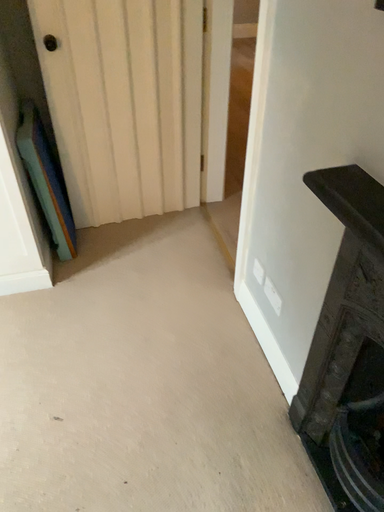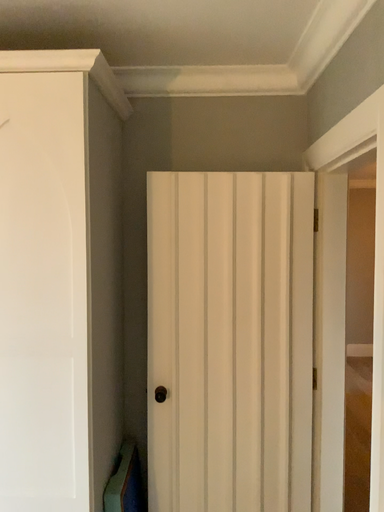
Question: Which way did the camera rotate in the video?

Choices:
 (A) rotated upward
 (B) rotated downward

Answer: (A)